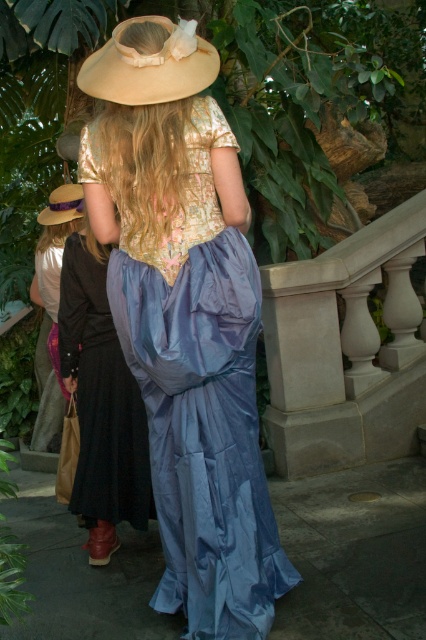
You are standing at the camera position in the botanical garden. You want to hand a small gift to the person wearing the matte blue dress at center. How many steps do you need to take to reach them?

The matte blue dress at center is 11.25 feet away from the camera. Assuming an average step length of 3 feet, you would need to take approximately 4 steps to reach them.

You are standing in the botanical garden and want to find the matte blue dress at center. According to the coordinates provided, in which direction should you look relative to your current position?

You should look towards the center of the image, as the matte blue dress at center is located at coordinates point [100,403], which corresponds to the central area.

You are a photographer trying to capture both the shiny blue fabric dress at center and the brown straw cowboy hat at upper left in a single frame. Given their sizes, which one might you need to adjust your camera focus on first to ensure clarity?

The shiny blue fabric dress at center is bigger than the brown straw cowboy hat at upper left, so you should focus on the shiny blue fabric dress at center first to ensure its details are clear before adjusting for the smaller object.